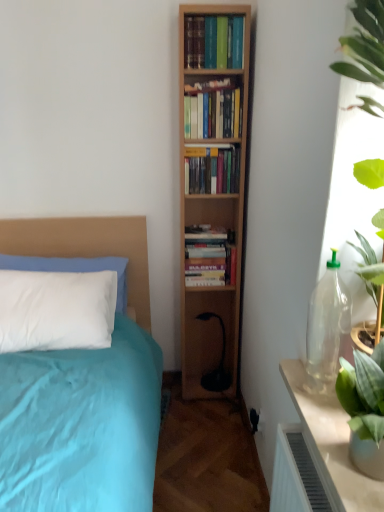
Question: Is hardcover books at center, which ranks as the fourth book in top-to-bottom order, wider or thinner than hardcover books at center, positioned as the 1th book in top-to-bottom order?

Choices:
 (A) thin
 (B) wide

Answer: (B)

Question: In terms of size, does hardcover books at center, which is the 1th book from bottom to top, appear bigger or smaller than hardcover books at center, positioned as the 1th book in top-to-bottom order?

Choices:
 (A) small
 (B) big

Answer: (B)

Question: Which object is positioned closest to the wooden bookshelf at center, the second book from the bottom?

Choices:
 (A) wooden bookshelf at center, which appears as the second book when viewed from the top
 (B) translucent glass table at right
 (C) hardcover books at center, positioned as the fourth book in bottom-to-top order
 (D) hardcover books at center, which ranks as the fourth book in top-to-bottom order
 (E) beige fabric headboard at left

Answer: (A)

Question: Which object is positioned farthest from the wooden bookshelf at center, which appears as the 3th book when viewed from the top?

Choices:
 (A) wooden bookshelf at center, which appears as the second book when viewed from the top
 (B) hardcover books at center, which ranks as the fourth book in top-to-bottom order
 (C) translucent glass table at right
 (D) beige fabric headboard at left
 (E) hardcover books at center, positioned as the 1th book in top-to-bottom order

Answer: (C)